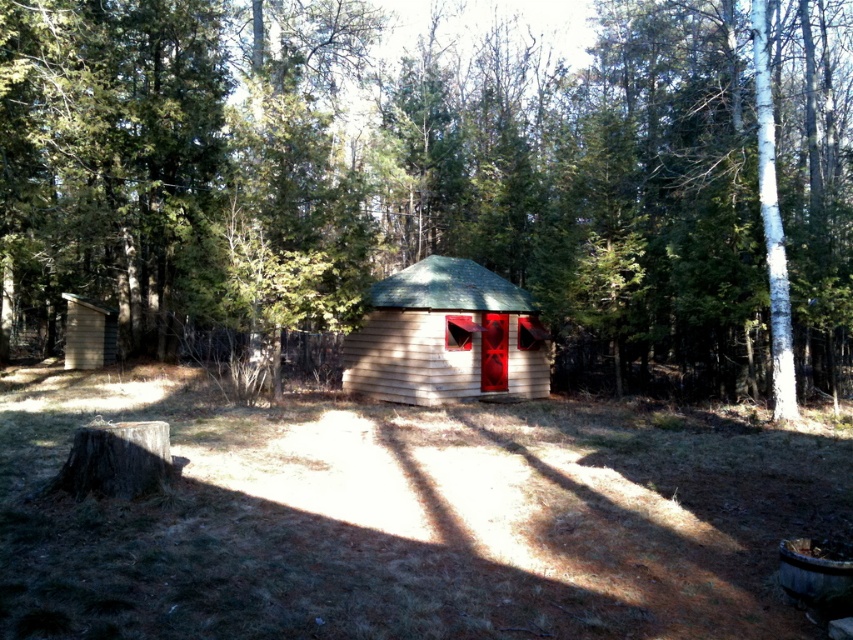
Between brown wood tree at center and light brown wooden log cabin at center, which one appears on the left side from the viewer's perspective?

From the viewer's perspective, brown wood tree at center appears more on the left side.

Between point (612, 240) and point (389, 384), which one is positioned behind?

The point (612, 240) is behind.

Where is `brown wood tree at center`? This screenshot has height=640, width=853. brown wood tree at center is located at coordinates (438, 177).

I want to click on brown wood tree at center, so click(438, 177).